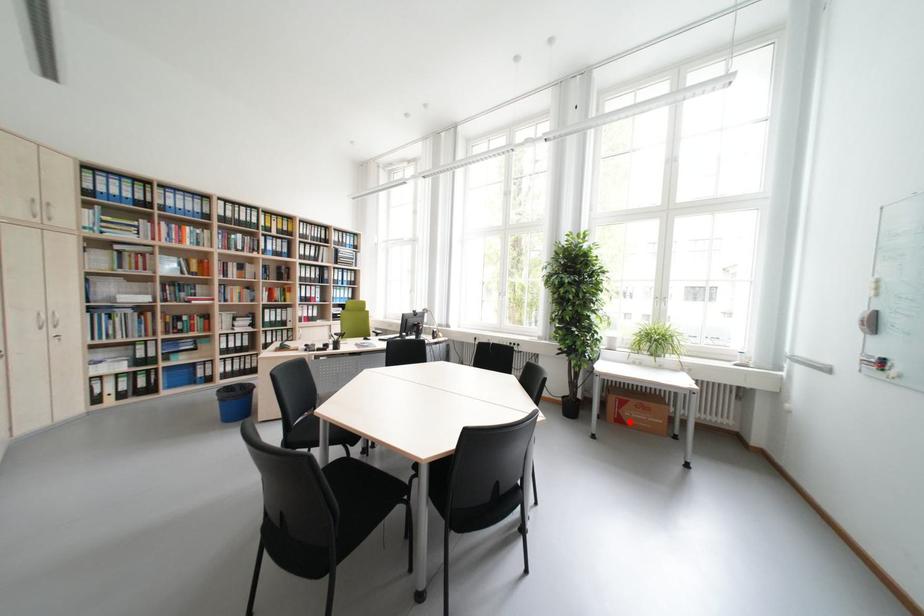
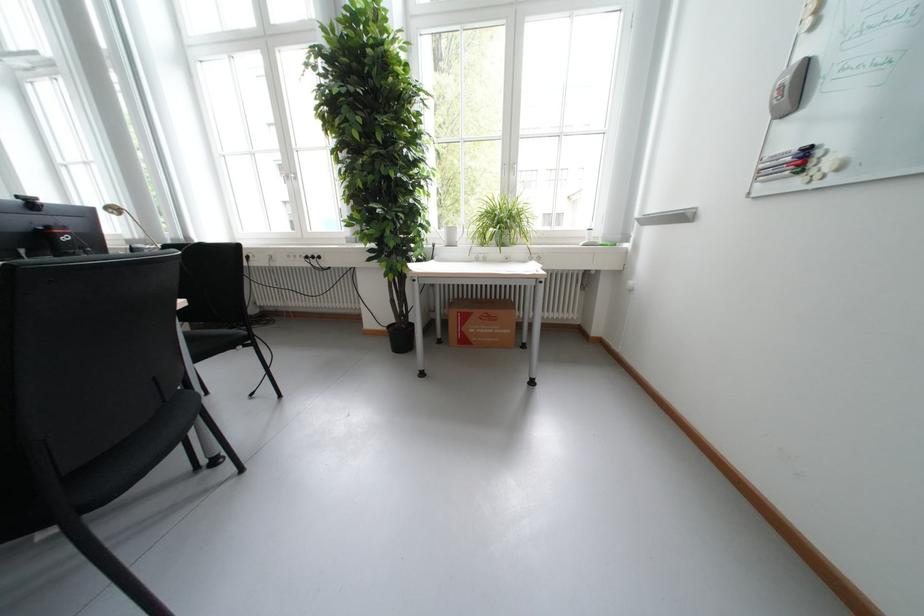
The point at the highlighted location is marked in the first image. Where is the corresponding point in the second image?

(475, 342)